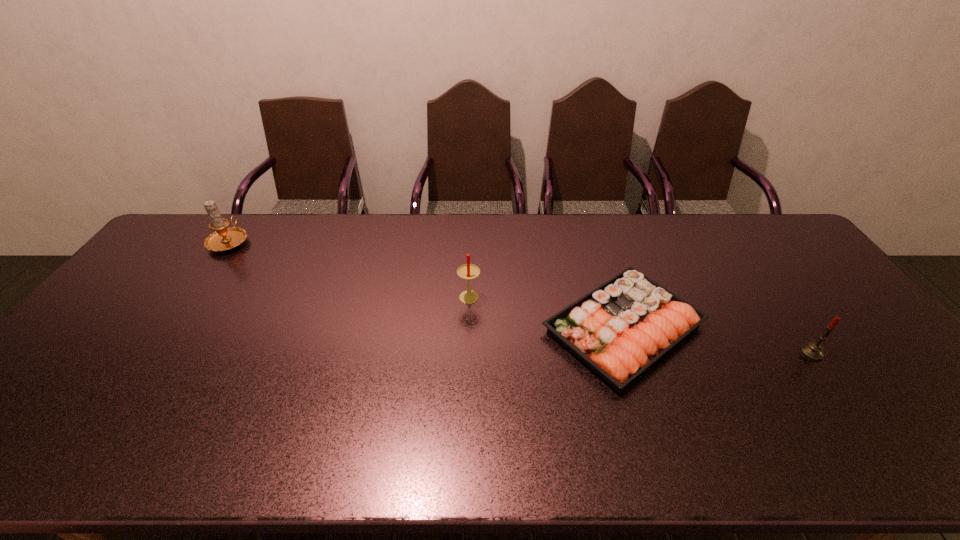
Choose which candle is the nearest neighbor to the leftmost object. Please provide its 2D coordinates. Your answer should be formatted as a tuple, i.e. [(x, y)], where the tuple contains the x and y coordinates of a point satisfying the conditions above.

[(468, 271)]